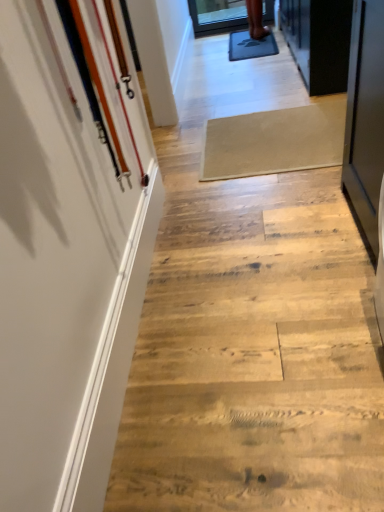
At what (x,y) coordinates should I click in order to perform the action: click on natural wood floor at center. Please return your answer as a coordinate pair (x, y). Looking at the image, I should click on (251, 326).

This screenshot has height=512, width=384. Describe the element at coordinates (251, 326) in the screenshot. I see `natural wood floor at center` at that location.

Where is `natural wood floor at center`? The image size is (384, 512). natural wood floor at center is located at coordinates (251, 326).